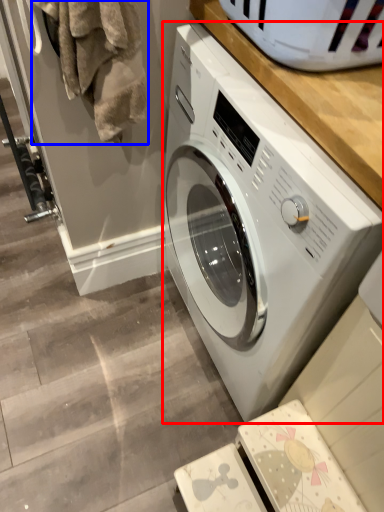
Question: Which of the following is the farthest to the observer, washing machine (highlighted by a red box) or laundry (highlighted by a blue box)?

Choices:
 (A) washing machine
 (B) laundry

Answer: (B)